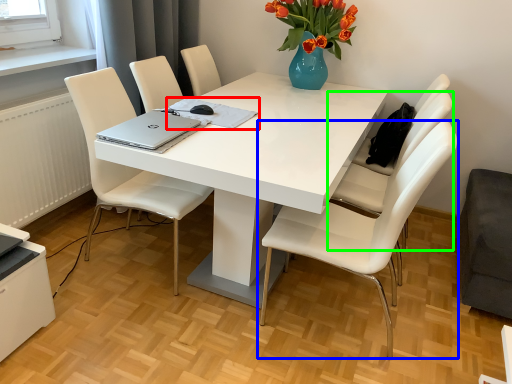
Question: Which is nearer to the notebook (highlighted by a red box)? chair (highlighted by a blue box) or chair (highlighted by a green box).

Choices:
 (A) chair
 (B) chair

Answer: (A)